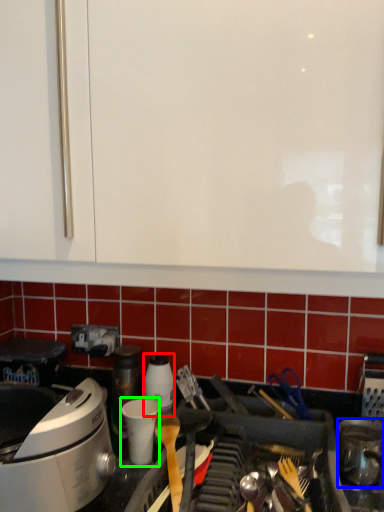
Question: Which is farther away from kitchen appliance (highlighted by a red box)? kitchen appliance (highlighted by a blue box) or appliance (highlighted by a green box)?

Choices:
 (A) kitchen appliance
 (B) appliance

Answer: (A)